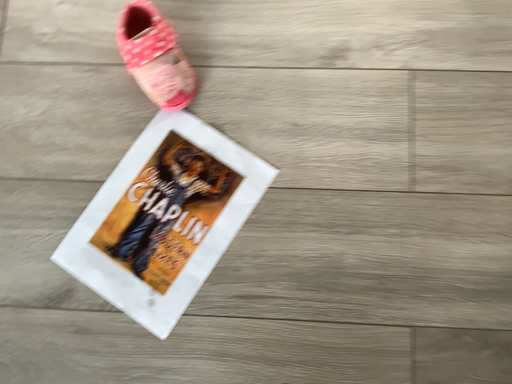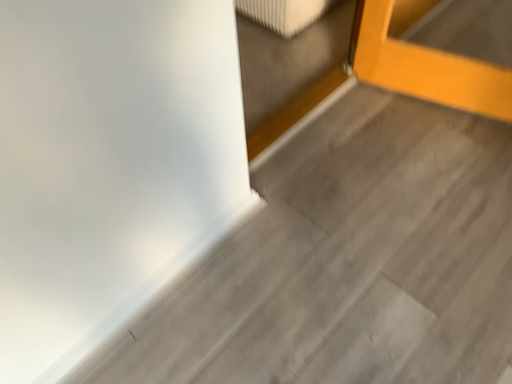
Question: Which way did the camera rotate in the video?

Choices:
 (A) rotated upward
 (B) rotated downward

Answer: (A)